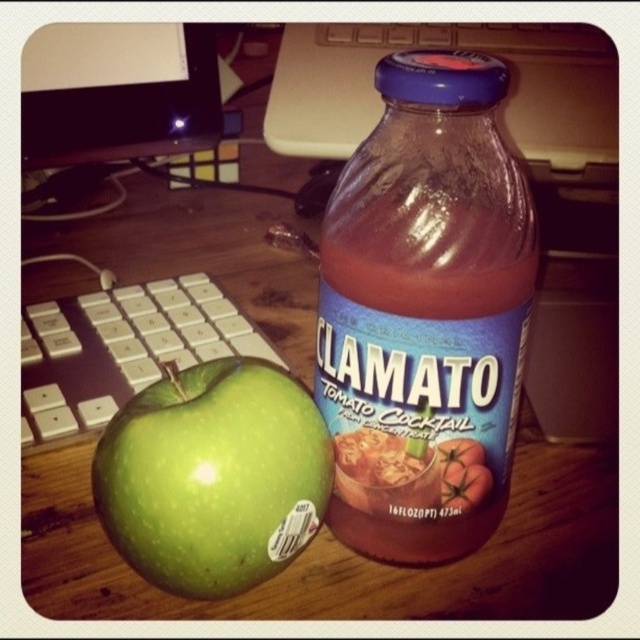
You are organizing items on a desk and need to place both the translucent glass bottle at center and the green matte apple at lower left into a drawer that can only accommodate items up to 8 centimeters in width. Which item might not fit if the bottle is 10 centimeters wide?

The translucent glass bottle at center has a width of 10 centimeters, which exceeds the drawer limit of 8 centimeters, so it might not fit.

Looking at this image, you are organizing items on a desk and need to stack the translucent glass bottle at center and the green matte apple at lower left. Which item should you place at the bottom to ensure stability?

You should place the translucent glass bottle at center at the bottom because it has a greater height compared to the green matte apple at lower left, providing a more stable base.

You are organizing items on a desk and need to place a new item at position coordinates point 0.5, 0.6. Is there already an object at that location? Please check the translucent glass bottle at center.

The translucent glass bottle at center is positioned at point (424, 312), so yes, there is an object near the desired coordinates (384, 320).